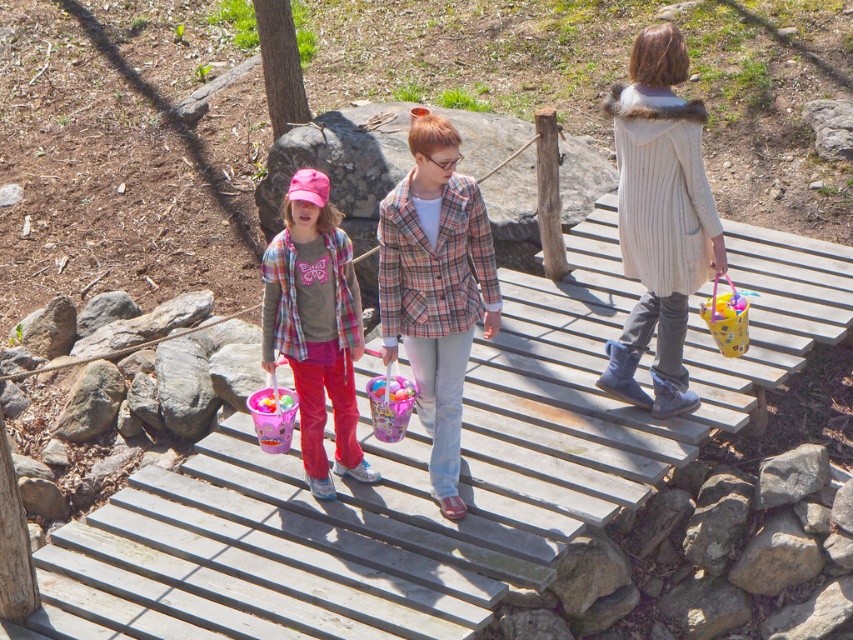
You are a photographer standing on the wooden bridge. You want to take a photo of the plaid fabric jacket at center and the translucent plastic bucket at center. How far apart are these two items in the photo?

The plaid fabric jacket at center and the translucent plastic bucket at center are 26.33 inches apart.

You are standing on the wooden bridge at center and want to hand a small package to the person wearing the white knitted coat at center. Can you reach them without leaving the bridge?

The wooden bridge at center is in front of the white knitted coat at center, so the person wearing the white knitted coat at center is behind the bridge. You cannot reach them while staying on the bridge.